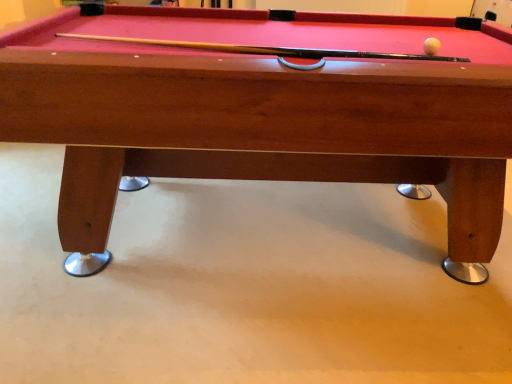
Identify the location of white glossy ball at upper right. This screenshot has width=512, height=384. (431, 46).

Based on the photo, in order to face white glossy ball at upper right, should I rotate leftwards or rightwards?

Rotate your view right by about 21.897°.

Measure the distance between white glossy ball at upper right and camera.

white glossy ball at upper right is 1.28 meters away from camera.

The width and height of the screenshot is (512, 384). Describe the element at coordinates (431, 46) in the screenshot. I see `white glossy ball at upper right` at that location.

What is the approximate width of white glossy ball at upper right?

white glossy ball at upper right is 4.92 centimeters wide.

Describe the element at coordinates (263, 133) in the screenshot. The width and height of the screenshot is (512, 384). I see `wooden billiard table at center` at that location.

Find the location of a particular element. The image size is (512, 384). wooden billiard table at center is located at coordinates (263, 133).

Locate an element on the screen. This screenshot has height=384, width=512. white glossy ball at upper right is located at coordinates (431, 46).

Does wooden billiard table at center appear on the left side of white glossy ball at upper right?

Yes, wooden billiard table at center is to the left of white glossy ball at upper right.

Considering their positions, is wooden billiard table at center located in front of or behind white glossy ball at upper right?

Visually, wooden billiard table at center is located in front of white glossy ball at upper right.

Considering the points (257, 177) and (440, 43), which point is behind, point (257, 177) or point (440, 43)?

The point (257, 177) is farther.

From the image's perspective, does wooden billiard table at center appear lower than white glossy ball at upper right?

Indeed, from the image's perspective, wooden billiard table at center is shown beneath white glossy ball at upper right.

From a real-world perspective, is wooden billiard table at center beneath white glossy ball at upper right?

Yes, from a real-world perspective, wooden billiard table at center is under white glossy ball at upper right.

Which of these two, wooden billiard table at center or white glossy ball at upper right, is wider?

With larger width is wooden billiard table at center.

Who is taller, wooden billiard table at center or white glossy ball at upper right?

wooden billiard table at center.

Who is bigger, wooden billiard table at center or white glossy ball at upper right?

wooden billiard table at center.

Is wooden billiard table at center positioned beyond the bounds of white glossy ball at upper right?

Yes, wooden billiard table at center is outside of white glossy ball at upper right.

Is wooden billiard table at center not near white glossy ball at upper right?

wooden billiard table at center is actually quite close to white glossy ball at upper right.

Could you tell me if wooden billiard table at center is facing white glossy ball at upper right?

No, wooden billiard table at center does not turn towards white glossy ball at upper right.

You are a GUI agent. You are given a task and a screenshot of the screen. Output one action in this format:
    pyautogui.click(x=<x>, y=<y>)
    Task: Click on the ball that is above the wooden billiard table at center (from a real-world perspective)
    
    Given the screenshot: What is the action you would take?
    pyautogui.click(x=431, y=46)

Is white glossy ball at upper right at the left side of wooden billiard table at center?

No.

In the image, is white glossy ball at upper right positioned in front of or behind wooden billiard table at center?

white glossy ball at upper right is behind wooden billiard table at center.

Is point (432, 45) closer to camera compared to point (53, 97)?

No, (432, 45) is further to viewer.

In the scene shown: From the image's perspective, is white glossy ball at upper right over wooden billiard table at center?

Yes, from the image's perspective, white glossy ball at upper right is above wooden billiard table at center.

From a real-world perspective, relative to wooden billiard table at center, is white glossy ball at upper right vertically above or below?

white glossy ball at upper right is situated higher than wooden billiard table at center in the real world.

Can you confirm if white glossy ball at upper right is thinner than wooden billiard table at center?

Correct, the width of white glossy ball at upper right is less than that of wooden billiard table at center.

Is white glossy ball at upper right taller or shorter than wooden billiard table at center?

In the image, white glossy ball at upper right appears to be shorter than wooden billiard table at center.

Which of these two, white glossy ball at upper right or wooden billiard table at center, is smaller?

With smaller size is white glossy ball at upper right.

Is wooden billiard table at center a part of white glossy ball at upper right?

Actually, wooden billiard table at center is outside white glossy ball at upper right.

Is white glossy ball at upper right far away from wooden billiard table at center?

Actually, white glossy ball at upper right and wooden billiard table at center are a little close together.

Consider the image. Could you tell me if white glossy ball at upper right is turned towards wooden billiard table at center?

Yes, white glossy ball at upper right is turned towards wooden billiard table at center.

Consider the image. How distant is white glossy ball at upper right from wooden billiard table at center?

The distance of white glossy ball at upper right from wooden billiard table at center is 27.77 inches.

Where is `billiard table directly beneath the white glossy ball at upper right (from a real-world perspective)`? billiard table directly beneath the white glossy ball at upper right (from a real-world perspective) is located at coordinates (263, 133).

Where is `billiard table in front of the white glossy ball at upper right`? billiard table in front of the white glossy ball at upper right is located at coordinates (263, 133).

This screenshot has height=384, width=512. Find the location of `billiard table on the left of white glossy ball at upper right`. billiard table on the left of white glossy ball at upper right is located at coordinates (263, 133).